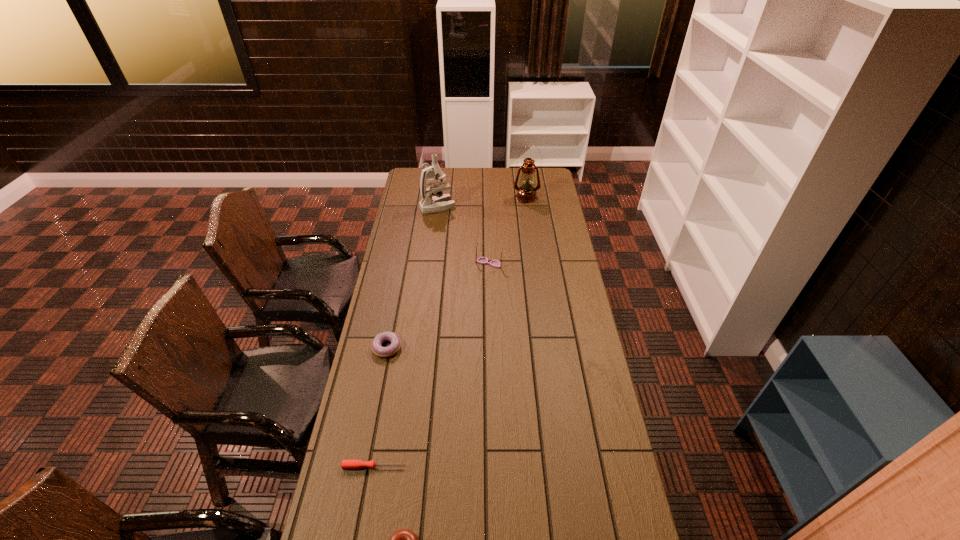
At what (x,y) coordinates should I click in order to perform the action: click on vacant space that satisfies the following two spatial constraints: 1. on the front side of the microscope; 2. at the tip of the screwdriver. Please return your answer as a coordinate pair (x, y). Looking at the image, I should click on (x=405, y=467).

Image resolution: width=960 pixels, height=540 pixels. I want to click on vacant point that satisfies the following two spatial constraints: 1. on the back side of the second object from right to left; 2. on the right side of the oil lamp, so click(488, 197).